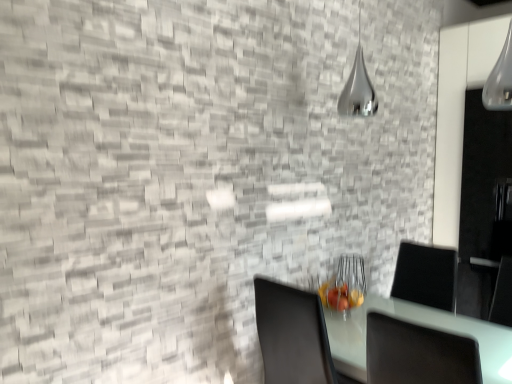
Question: Visually, is transparent glass door at right positioned to the left or to the right of white glossy table at lower right?

Choices:
 (A) right
 (B) left

Answer: (A)

Question: From the image's perspective, relative to white glossy table at lower right, is transparent glass door at right above or below?

Choices:
 (A) below
 (B) above

Answer: (B)

Question: Which of these objects is positioned farthest from the silver metallic lamp at upper center?

Choices:
 (A) white glossy table at lower right
 (B) transparent glass door at right

Answer: (A)

Question: Based on their relative distances, which object is nearer to the silver metallic lamp at upper center?

Choices:
 (A) white glossy table at lower right
 (B) transparent glass door at right

Answer: (B)